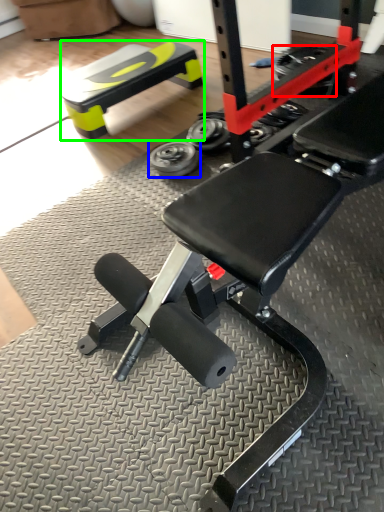
Question: Which is nearer to the tire (highlighted by a red box)? wheel (highlighted by a blue box) or bench (highlighted by a green box).

Choices:
 (A) wheel
 (B) bench

Answer: (B)